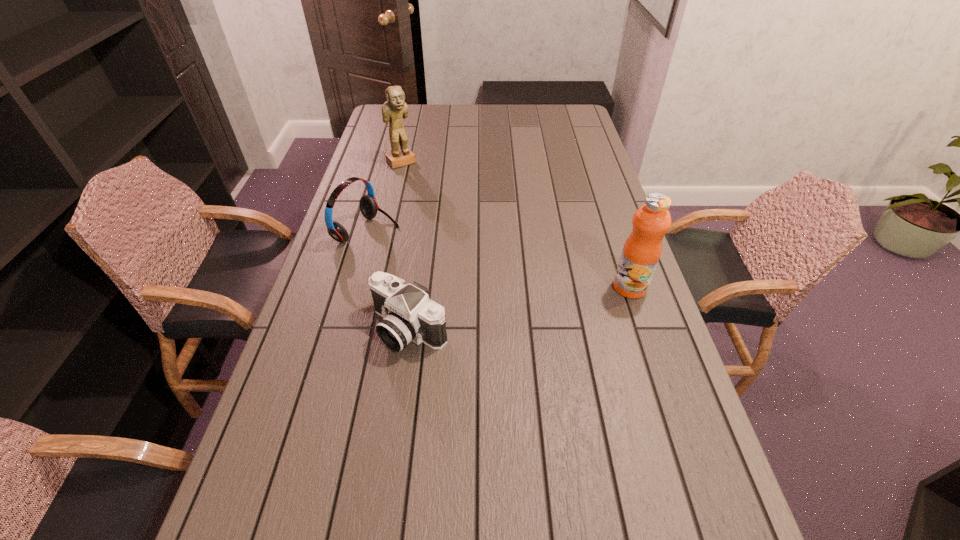
I want to click on free point between the second nearest object and the camera, so click(x=519, y=308).

Locate which object ranks third in proximity to the fruit juice. Please provide its 2D coordinates. Your answer should be formatted as a tuple, i.e. [(x, y)], where the tuple contains the x and y coordinates of a point satisfying the conditions above.

[(395, 108)]

Image resolution: width=960 pixels, height=540 pixels. I want to click on object that is the third closest to the figurine, so click(x=642, y=250).

At what (x,y) coordinates should I click in order to perform the action: click on vacant area that satisfies the following two spatial constraints: 1. on the front side of the headset; 2. on the right side of the camera. Please return your answer as a coordinate pair (x, y). The height and width of the screenshot is (540, 960). Looking at the image, I should click on (340, 328).

Find the location of a particular element. This screenshot has width=960, height=540. free location that satisfies the following two spatial constraints: 1. on the front side of the nearest object; 2. on the right side of the farthest object is located at coordinates (361, 328).

Locate an element on the screen. The image size is (960, 540). vacant position in the image that satisfies the following two spatial constraints: 1. on the front side of the shortest object; 2. on the right side of the farthest object is located at coordinates (361, 328).